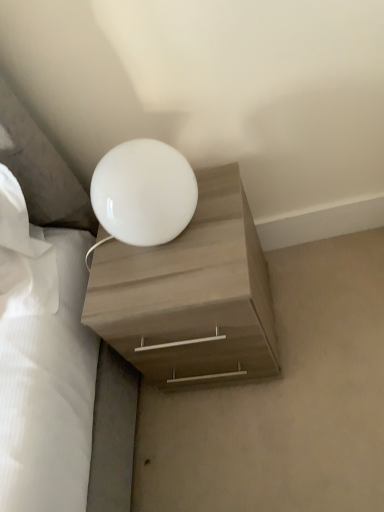
Where is `vacant region to the left of white glossy sphere at upper center`? This screenshot has width=384, height=512. vacant region to the left of white glossy sphere at upper center is located at coordinates (106, 274).